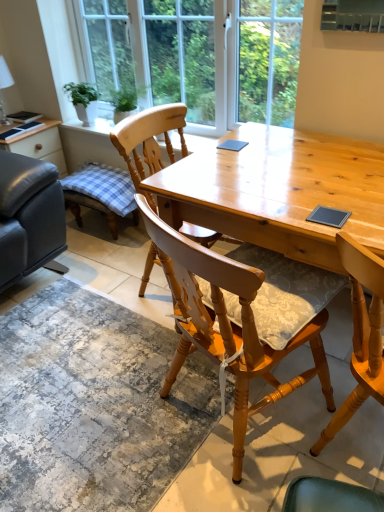
Identify the location of light brown wooden desk at center. Image resolution: width=384 pixels, height=512 pixels. (279, 192).

I want to click on textured gray rug at lower center, so click(94, 405).

In order to face wooden chair with cushion at center, which appears as the 1th chair when viewed from the front, should I rotate leftwards or rightwards?

It's best to rotate right around 7.718 degrees.

This screenshot has height=512, width=384. What do you see at coordinates (228, 324) in the screenshot?
I see `wooden chair with cushion at center, which appears as the 1th chair when viewed from the front` at bounding box center [228, 324].

Describe the element at coordinates (197, 56) in the screenshot. Image resolution: width=384 pixels, height=512 pixels. I see `clear glass window at upper center` at that location.

Locate an element on the screen. This screenshot has width=384, height=512. light brown wooden desk at center is located at coordinates tap(279, 192).

Is matte black leather couch at left surrounded by light brown wooden desk at center?

No, matte black leather couch at left is located outside of light brown wooden desk at center.

Is light brown wooden desk at center directly adjacent to matte black leather couch at left?

They are not placed beside each other.

Looking at this image, looking at their sizes, would you say light brown wooden desk at center is wider or thinner than matte black leather couch at left?

light brown wooden desk at center is wider than matte black leather couch at left.

From a real-world perspective, is light brown wooden desk at center below matte black leather couch at left?

Yes.

Is wooden chair at center, which is counted as the 1th chair, starting from the back, oriented away from clear glass window at upper center?

No.

From the image's perspective, is wooden chair at center, which is counted as the 1th chair, starting from the back, on top of clear glass window at upper center?

No, from the image's perspective, wooden chair at center, which is counted as the 1th chair, starting from the back, is not over clear glass window at upper center.

Which object is wider, wooden chair at center, the 2th chair in the front-to-back sequence, or clear glass window at upper center?

With larger width is wooden chair at center, the 2th chair in the front-to-back sequence.

Which of these two, wooden chair at center, the 2th chair in the front-to-back sequence, or clear glass window at upper center, stands shorter?

clear glass window at upper center is shorter.

From the image's perspective, which one is positioned higher, wooden chair at center, the 2th chair in the front-to-back sequence, or textured gray rug at lower center?

wooden chair at center, the 2th chair in the front-to-back sequence, is shown above in the image.

Based on the photo, who is smaller, wooden chair at center, which is counted as the 1th chair, starting from the back, or textured gray rug at lower center?

Smaller between the two is textured gray rug at lower center.

Does point (187, 227) appear closer or farther from the camera than point (97, 432)?

Point (187, 227) appears to be farther away from the viewer than point (97, 432).

Is textured gray rug at lower center surrounded by wooden chair at center, which is counted as the 1th chair, starting from the back?

No, textured gray rug at lower center is not inside wooden chair at center, which is counted as the 1th chair, starting from the back.

Who is shorter, wooden chair with cushion at center, which appears as the 1th chair when viewed from the front, or wooden chair at center, the 2th chair in the front-to-back sequence?

Standing shorter between the two is wooden chair at center, the 2th chair in the front-to-back sequence.

Does wooden chair with cushion at center, the second chair from the back, come behind wooden chair at center, which is counted as the 1th chair, starting from the back?

No, wooden chair with cushion at center, the second chair from the back, is closer to the camera.

Does point (164, 251) come closer to viewer compared to point (127, 157)?

Yes.

From a real-world perspective, is wooden chair with cushion at center, which appears as the 1th chair when viewed from the front, located higher than wooden chair at center, the 2th chair in the front-to-back sequence?

Yes, from a real-world perspective, wooden chair with cushion at center, which appears as the 1th chair when viewed from the front, is on top of wooden chair at center, the 2th chair in the front-to-back sequence.

Considering the sizes of wooden chair at center, the 2th chair in the front-to-back sequence, and wooden chair with cushion at center, the second chair from the back, in the image, is wooden chair at center, the 2th chair in the front-to-back sequence, wider or thinner than wooden chair with cushion at center, the second chair from the back,?

Clearly, wooden chair at center, the 2th chair in the front-to-back sequence, has less width compared to wooden chair with cushion at center, the second chair from the back.

Does point (174, 110) come behind point (307, 335)?

Yes, point (174, 110) is farther from viewer.

From the image's perspective, would you say wooden chair at center, which is counted as the 1th chair, starting from the back, is shown under wooden chair with cushion at center, which appears as the 1th chair when viewed from the front?

No.

Considering the sizes of clear glass window at upper center and matte black leather couch at left in the image, is clear glass window at upper center wider or thinner than matte black leather couch at left?

In the image, clear glass window at upper center appears to be more narrow than matte black leather couch at left.

Between clear glass window at upper center and matte black leather couch at left, which one has smaller size?

matte black leather couch at left.

Identify the location of window located above the matte black leather couch at left (from the image's perspective). (197, 56).

From the image's perspective, is clear glass window at upper center located beneath matte black leather couch at left?

Incorrect, from the image's perspective, clear glass window at upper center is higher than matte black leather couch at left.

Considering the sizes of objects light brown wooden desk at center and textured gray rug at lower center in the image provided, who is thinner, light brown wooden desk at center or textured gray rug at lower center?

light brown wooden desk at center.

Considering the sizes of light brown wooden desk at center and textured gray rug at lower center in the image, is light brown wooden desk at center taller or shorter than textured gray rug at lower center?

Clearly, light brown wooden desk at center is taller compared to textured gray rug at lower center.

From the image's perspective, which one is positioned higher, light brown wooden desk at center or textured gray rug at lower center?

light brown wooden desk at center, from the image's perspective.

Is light brown wooden desk at center in contact with textured gray rug at lower center?

No, light brown wooden desk at center is not beside textured gray rug at lower center.

The height and width of the screenshot is (512, 384). What are the coordinates of `table above the light brown wooden desk at center (from a real-world perspective)` in the screenshot? It's located at (39, 144).

At what (x,y) coordinates should I click in order to perform the action: click on window behind the wooden chair at center, which is counted as the 1th chair, starting from the back. Please return your answer as a coordinate pair (x, y). The height and width of the screenshot is (512, 384). Looking at the image, I should click on (197, 56).

From the image, which object appears to be farther from wooden chair at center, the 2th chair in the front-to-back sequence, matte black leather couch at left or clear glass window at upper center?

matte black leather couch at left.

From the image, which object appears to be farther from wooden chair at center, the 2th chair in the front-to-back sequence, clear glass window at upper center or wooden chair with cushion at center, the second chair from the back?

Among the two, wooden chair with cushion at center, the second chair from the back, is located further to wooden chair at center, the 2th chair in the front-to-back sequence.

Which object lies further to the anchor point wooden chair with cushion at center, which appears as the 1th chair when viewed from the front, textured gray rug at lower center or matte black leather couch at left?

matte black leather couch at left is further to wooden chair with cushion at center, which appears as the 1th chair when viewed from the front.

Considering their positions, is matte black leather couch at left positioned further to clear glass window at upper center than wooden chair at center, which is counted as the 1th chair, starting from the back?

matte black leather couch at left is positioned further to the anchor clear glass window at upper center.

Estimate the real-world distances between objects in this image. Which object is closer to matte black leather couch at left, green leafy plant in white pot at upper left or textured gray rug at lower center?

Based on the image, green leafy plant in white pot at upper left appears to be nearer to matte black leather couch at left.

From the image, which object appears to be farther from matte black leather couch at left, wooden chair with cushion at center, which appears as the 1th chair when viewed from the front, or textured gray rug at lower center?

Based on the image, wooden chair with cushion at center, which appears as the 1th chair when viewed from the front, appears to be further to matte black leather couch at left.

From the image, which object appears to be farther from textured gray rug at lower center, light brown wooden desk at center or wooden chair at center, which is counted as the 1th chair, starting from the back?

Based on the image, wooden chair at center, which is counted as the 1th chair, starting from the back, appears to be further to textured gray rug at lower center.

Considering their positions, is textured gray rug at lower center positioned further to matte black leather couch at left than clear glass window at upper center?

textured gray rug at lower center lies further to matte black leather couch at left than the other object.

You are a GUI agent. You are given a task and a screenshot of the screen. Output one action in this format:
    pyautogui.click(x=<x>, y=<y>)
    Task: Click on the table between clear glass window at upper center and textured gray rug at lower center vertically
    Image resolution: width=384 pixels, height=512 pixels.
    Given the screenshot: What is the action you would take?
    pyautogui.click(x=39, y=144)

Locate an element on the screen. The image size is (384, 512). houseplant between clear glass window at upper center and textured gray rug at lower center from top to bottom is located at coordinates pyautogui.click(x=83, y=101).

Identify the location of mat positioned between light brown wooden desk at center and green leafy plant in white pot at upper left from near to far. (94, 405).

I want to click on mat positioned between light brown wooden desk at center and matte black leather couch at left from near to far, so click(x=94, y=405).